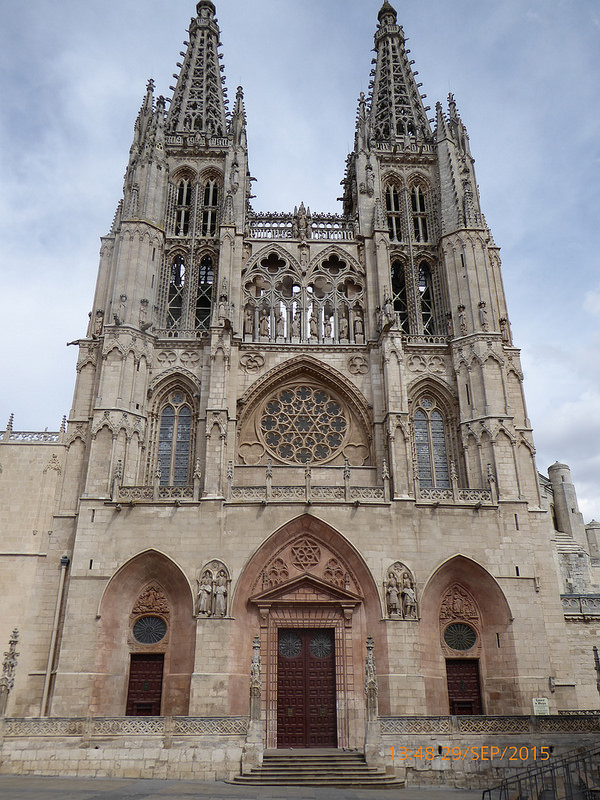
Where is `main door`? Image resolution: width=600 pixels, height=800 pixels. main door is located at coordinates (298, 690), (321, 692).